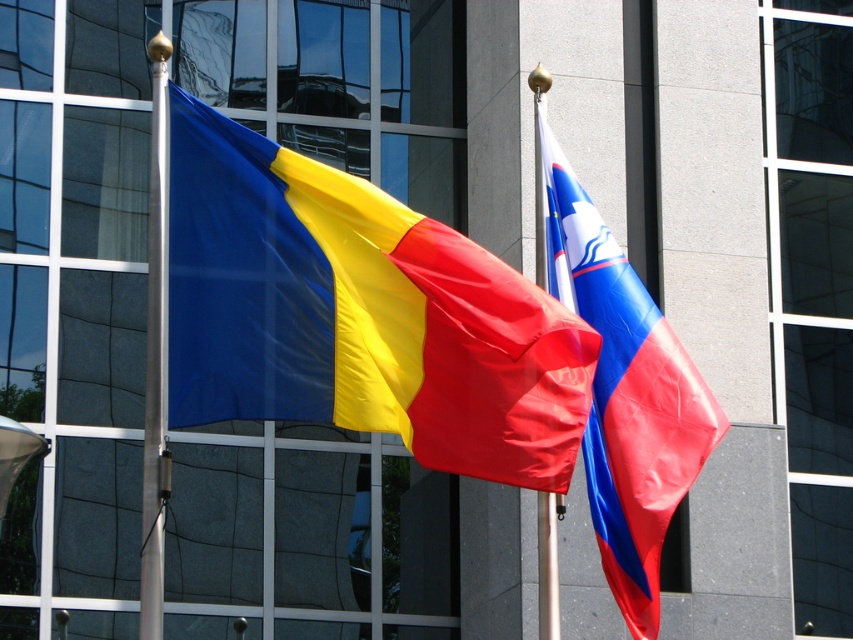
Which of these two, silky fabric flag at left or polished metal flag pole at left, stands shorter?

silky fabric flag at left

Does point (395, 307) lie in front of point (161, 550)?

Yes.

Based on the photo, who is more forward, [518,384] or [148,554]?

Point [518,384]

This screenshot has width=853, height=640. In order to click on silky fabric flag at left in this screenshot , I will do `click(358, 314)`.

What do you see at coordinates (624, 388) in the screenshot?
I see `blue and white fabric flag at center` at bounding box center [624, 388].

Locate an element on the screen. blue and white fabric flag at center is located at coordinates (624, 388).

What are the coordinates of `blue and white fabric flag at center` in the screenshot? It's located at (624, 388).

Between silky fabric flag at left and metallic silver flag pole at center, which one appears on the right side from the viewer's perspective?

From the viewer's perspective, metallic silver flag pole at center appears more on the right side.

Is point (177, 88) positioned in front of point (550, 634)?

Yes, point (177, 88) is in front of point (550, 634).

Identify the location of silky fabric flag at left. This screenshot has width=853, height=640. click(x=358, y=314).